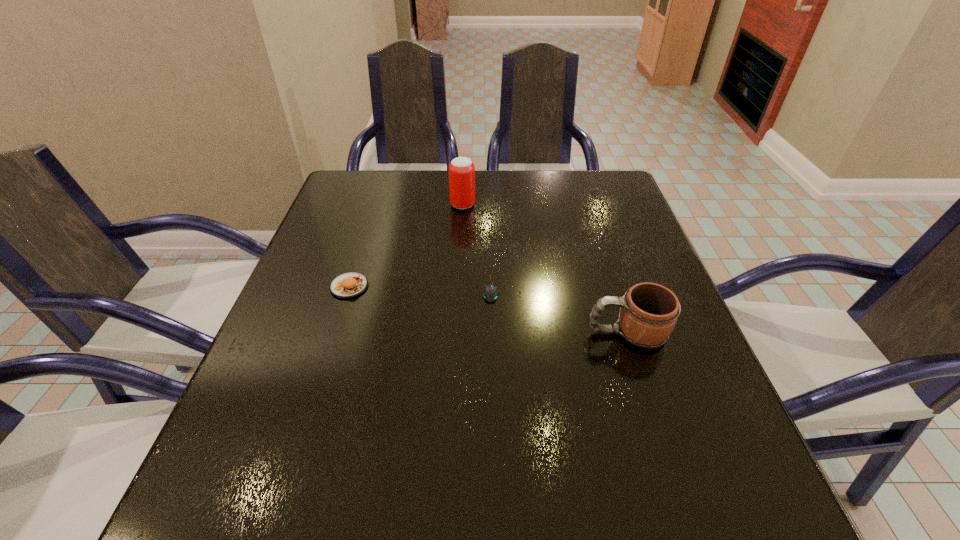
In the image, there is a desktop. Identify the location of free space at the right edge. This screenshot has height=540, width=960. (701, 450).

At what (x,y) coordinates should I click in order to perform the action: click on vacant space at the far left corner of the desktop. Please return your answer as a coordinate pair (x, y). Image resolution: width=960 pixels, height=540 pixels. Looking at the image, I should click on (378, 177).

Where is `empty location between the rightmost object and the leftmost object`? The height and width of the screenshot is (540, 960). empty location between the rightmost object and the leftmost object is located at coordinates (488, 309).

Find the location of a particular element. The height and width of the screenshot is (540, 960). blank region between the mug and the second shortest object is located at coordinates (488, 309).

This screenshot has height=540, width=960. What are the coordinates of `vacant point located between the second shortest object and the second object from left to right` in the screenshot? It's located at (406, 246).

You are a GUI agent. You are given a task and a screenshot of the screen. Output one action in this format:
    pyautogui.click(x=<x>, y=<y>)
    Task: Click on the free space between the beer can and the rightmost object
    The image size is (960, 540).
    Given the screenshot: What is the action you would take?
    pyautogui.click(x=545, y=269)

Find the location of a particular element. The height and width of the screenshot is (540, 960). vacant space that's between the shortest object and the leftmost object is located at coordinates (420, 285).

The image size is (960, 540). I want to click on free space between the rightmost object and the leftmost object, so click(488, 309).

Locate an element on the screen. empty space that is in between the nearest object and the tallest object is located at coordinates click(545, 269).

You are a GUI agent. You are given a task and a screenshot of the screen. Output one action in this format:
    pyautogui.click(x=<x>, y=<y>)
    Task: Click on the free point between the mug and the beer can
    
    Given the screenshot: What is the action you would take?
    pyautogui.click(x=545, y=269)